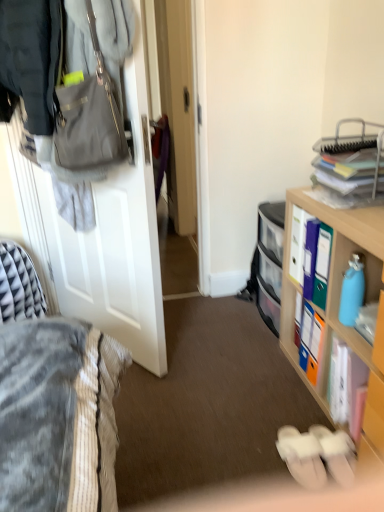
This screenshot has width=384, height=512. I want to click on free space to the left of white fabric slippers at lower center, positioned as the second footwear in left-to-right order, so click(266, 461).